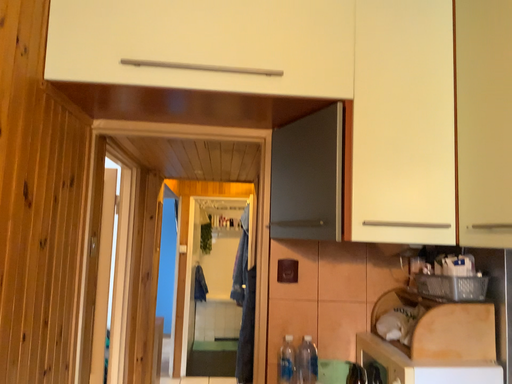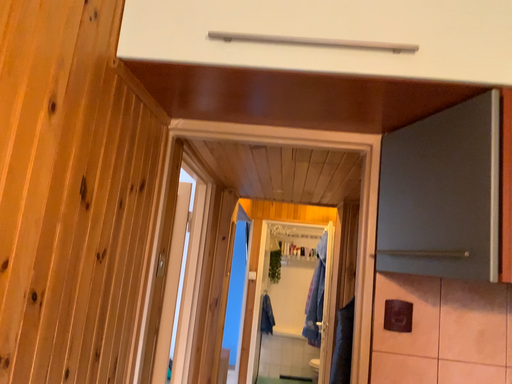
Question: How did the camera likely rotate when shooting the video?

Choices:
 (A) rotated left
 (B) rotated right

Answer: (A)